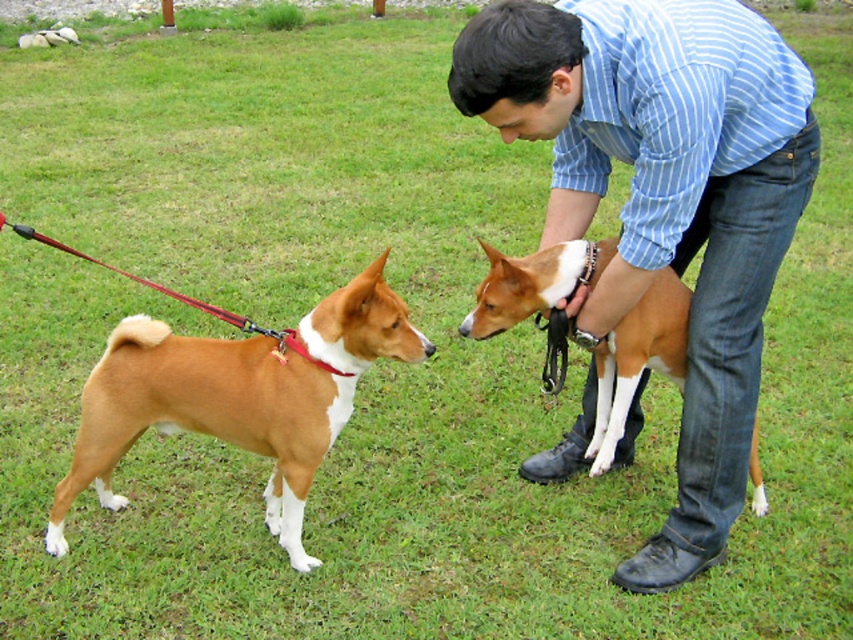
Question: Which point appears closest to the camera in this image?

Choices:
 (A) (294, 342)
 (B) (483, 282)
 (C) (601, 81)

Answer: (C)

Question: Which object is the farthest from the red fabric leash at left?

Choices:
 (A) brown smooth dog at left
 (B) brown smooth dog at center

Answer: (B)

Question: Which of the following is the farthest from the observer?

Choices:
 (A) (45, 547)
 (B) (648, 356)

Answer: (A)

Question: Can you confirm if brown smooth dog at left is positioned above brown smooth dog at center?

Choices:
 (A) yes
 (B) no

Answer: (B)

Question: Does blue striped shirt at upper center come behind brown smooth dog at left?

Choices:
 (A) no
 (B) yes

Answer: (A)

Question: Is blue striped shirt at upper center bigger than brown smooth dog at left?

Choices:
 (A) yes
 (B) no

Answer: (A)